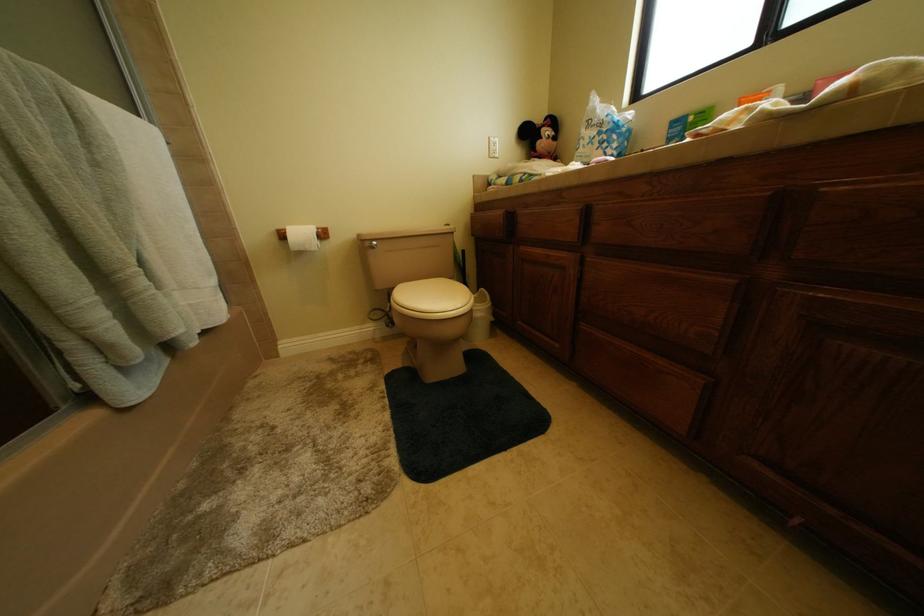
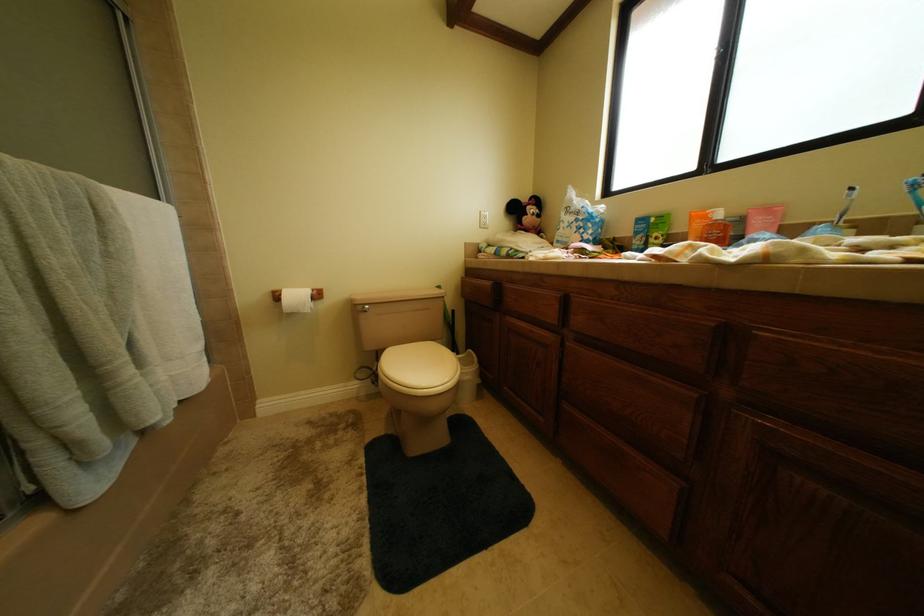
Question: In a continuous first-person perspective shot, in which direction is the camera moving?

Choices:
 (A) Left
 (B) Right
 (C) Forward
 (D) Backward

Answer: (D)